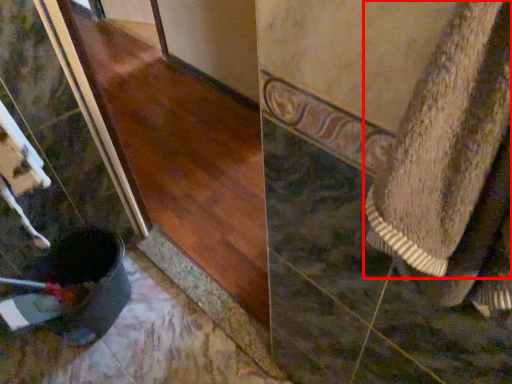
Question: From the image, what is the correct spatial relationship of towel (annotated by the red box) in relation to wood?

Choices:
 (A) right
 (B) left

Answer: (A)